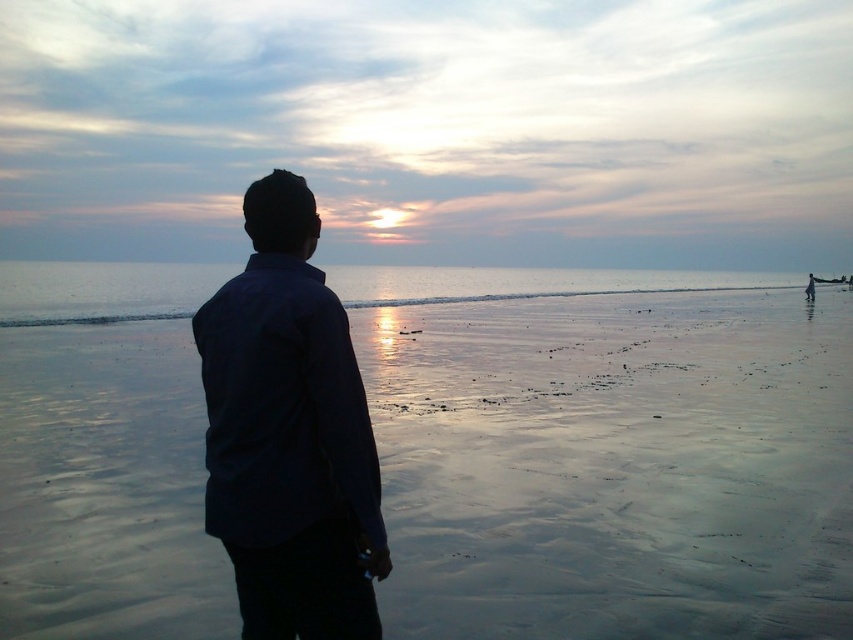
Is point (259, 336) farther from camera compared to point (546, 280)?

No, it is not.

Which of these two, dark blue shirt at center or glistening silver water at center, stands taller?

With more height is glistening silver water at center.

Between point (339, 502) and point (39, 305), which one is positioned behind?

The point (39, 305) is behind.

Find the location of a particular element. dark blue shirt at center is located at coordinates (289, 433).

Is the position of smooth sand at center less distant than that of dark blue shirt at center?

That is False.

Can you confirm if smooth sand at center is positioned above dark blue shirt at center?

Yes.

Between point (399, 440) and point (303, 600), which one is positioned in front?

Point (303, 600) is more forward.

Locate an element on the screen. smooth sand at center is located at coordinates (614, 465).

Which of these two, smooth sand at center or glistening silver water at center, stands taller?

glistening silver water at center

Measure the distance between smooth sand at center and glistening silver water at center.

The distance of smooth sand at center from glistening silver water at center is 51.03 meters.

Who is more distant from viewer, (662,488) or (477,292)?

Point (477,292)

The height and width of the screenshot is (640, 853). What are the coordinates of `smooth sand at center` in the screenshot? It's located at (614, 465).